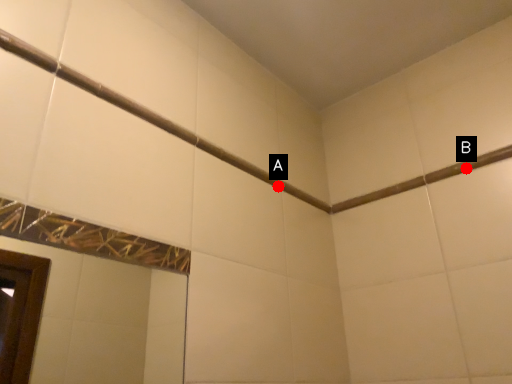
Question: Two points are circled on the image, labeled by A and B beside each circle. Which point is closer to the camera?

Choices:
 (A) A is closer
 (B) B is closer

Answer: (B)